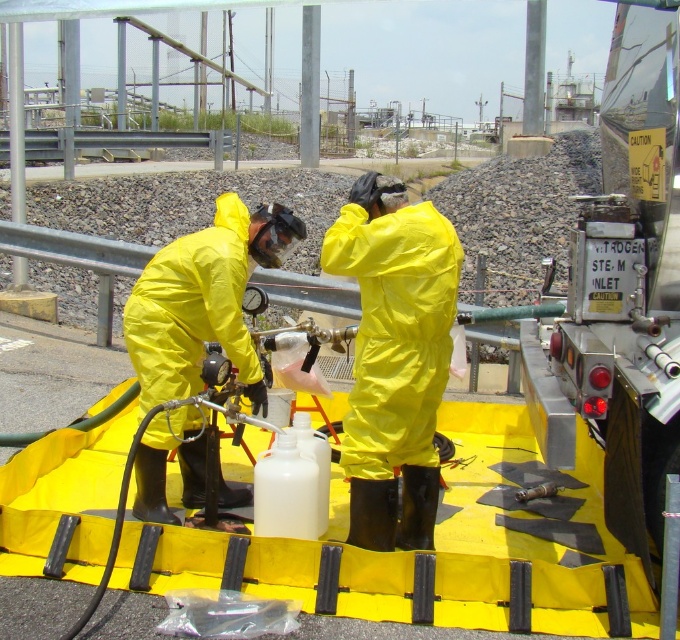
Question: Does yellow matte suit at center have a smaller size compared to matte yellow hazmat suit at center?

Choices:
 (A) yes
 (B) no

Answer: (A)

Question: Which object is closer to the camera taking this photo?

Choices:
 (A) matte yellow hazmat suit at center
 (B) yellow matte suit at center

Answer: (B)

Question: Considering the relative positions of yellow matte suit at center and matte yellow hazmat suit at center in the image provided, where is yellow matte suit at center located with respect to matte yellow hazmat suit at center?

Choices:
 (A) above
 (B) below

Answer: (B)

Question: Does yellow matte suit at center have a lesser width compared to matte yellow hazmat suit at center?

Choices:
 (A) yes
 (B) no

Answer: (A)

Question: Which point is farther to the camera?

Choices:
 (A) matte yellow hazmat suit at center
 (B) yellow matte suit at center

Answer: (A)